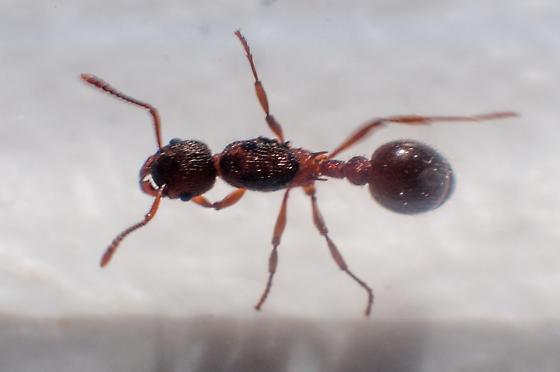
Image resolution: width=560 pixels, height=372 pixels. In order to click on bottom leg in this screenshot , I will do `click(359, 133)`.